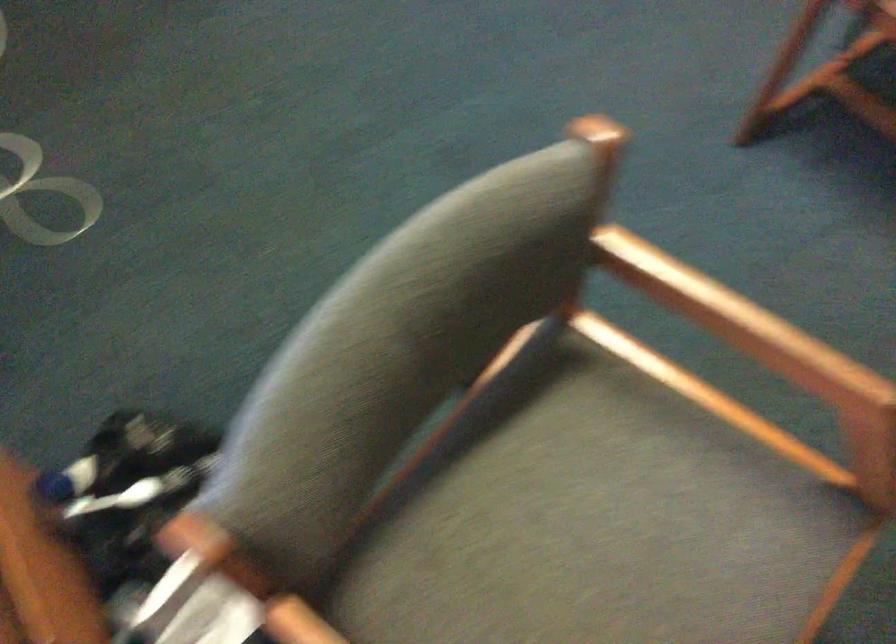
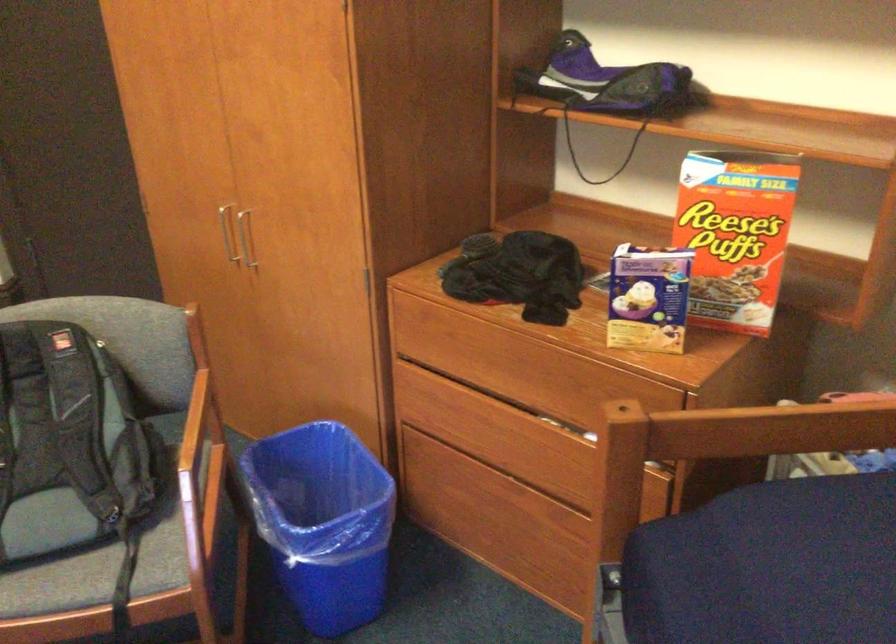
Question: How did the camera likely rotate?

Choices:
 (A) Left
 (B) Right
 (C) Up
 (D) Down

Answer: (B)